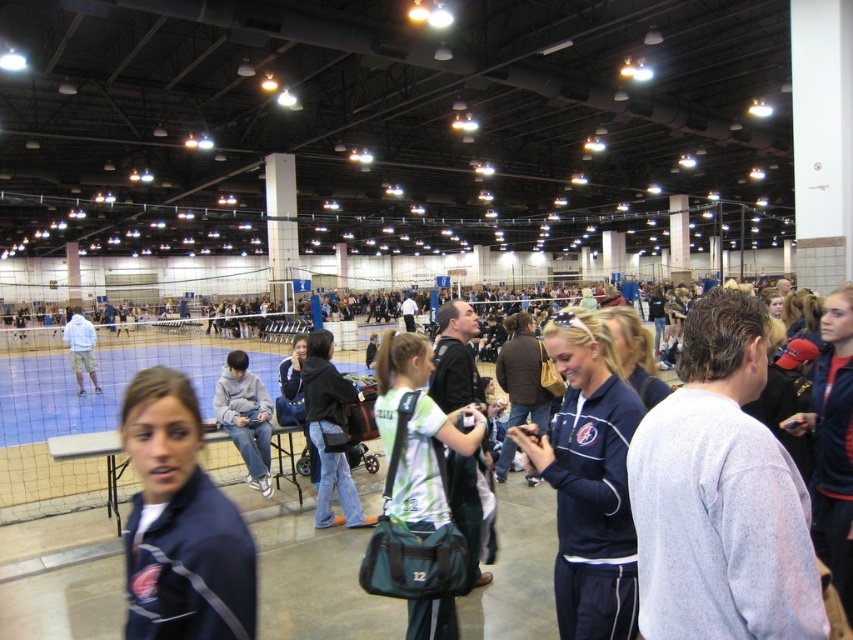
You are a photographer trying to capture a group photo of the gray sweatshirt at center and the navy blue tracksuit at center. If you want to ensure both are fully visible in the frame, which clothing item should you focus on to avoid cropping?

The gray sweatshirt at center is narrower than the navy blue tracksuit at center, so focusing on the navy blue tracksuit at center ensures both will fit without cropping.

In the scene shown: You are a photographer positioned at the back of the gymnasium and want to take a photo of both the navy blue jacket at center and the denim jacket at center. Which jacket will appear larger in your photo?

The navy blue jacket at center will appear larger in the photo because it is closer to the viewer than the denim jacket at center.

You are a photographer positioned at the back of the gymnasium. You need to capture a photo of both the gray sweatshirt at center and the navy blue tracksuit at center in the same frame. The camera you are using has a minimum focus distance of 50 centimeters. Will you be able to take the photo without moving closer?

The gray sweatshirt at center is 52.79 centimeters from the navy blue tracksuit at center. Since the camera requires a minimum focus distance of 50 centimeters, the photographer can capture both items in the same frame without moving closer because the distance between them meets the requirement.